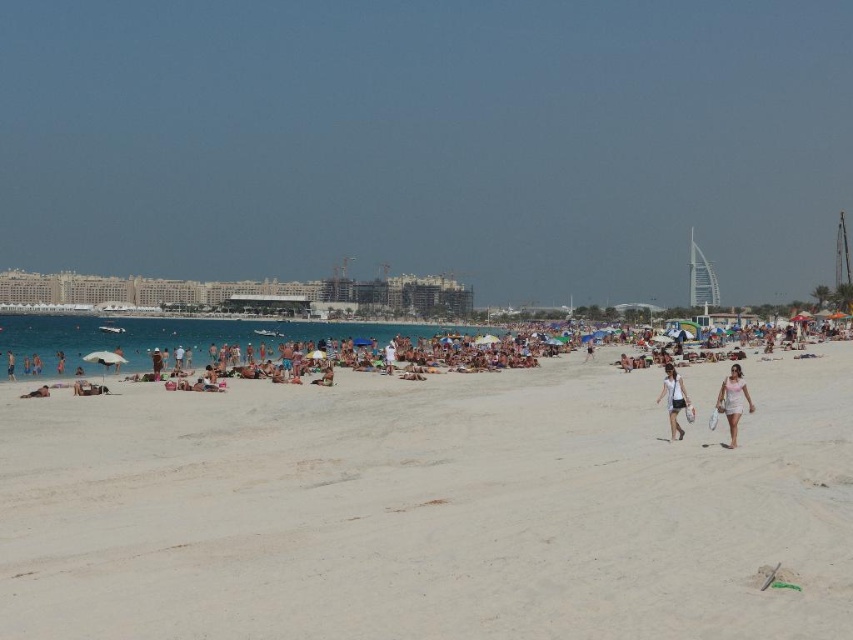
You are standing on the white sandy beach at center and want to reach the tan skin person at lower left. Which direction should you move to get closer to them?

The white sandy beach at center is to the right of the tan skin person at lower left, so you should move to the left to get closer to them.

You are a photographer on the beach and want to capture both the pink fabric shorts at lower right and the white fabric shorts at center in a single frame. Which direction should you move to ensure both are visible in your camera view?

You should move to the left so that both the pink fabric shorts at lower right and the white fabric shorts at center are visible in your camera view, as the pink fabric shorts at lower right are to the right of the white fabric shorts at center.